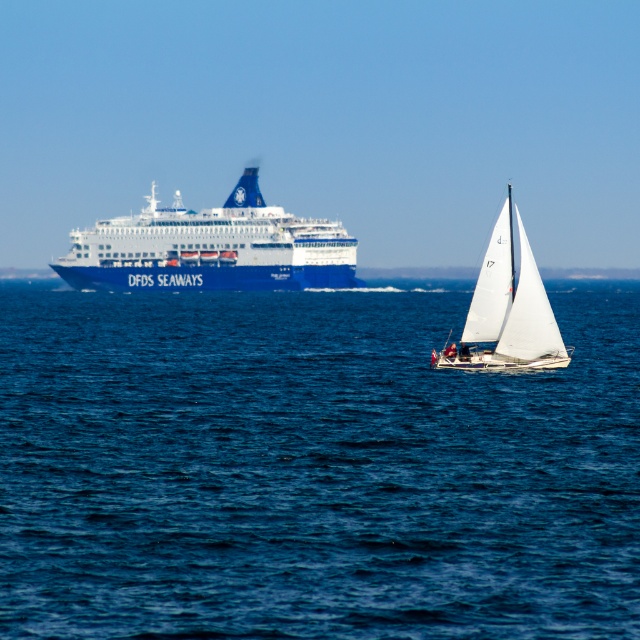
Describe the element at coordinates (312, 467) in the screenshot. I see `blue water at center` at that location.

Who is lower down, blue water at center or blue metallic cruise ship at upper left?

Positioned lower is blue water at center.

Between point (65, 632) and point (204, 273), which one is positioned behind?

The point (204, 273) is behind.

Identify the location of blue water at center. (312, 467).

Does blue water at center have a smaller size compared to white sailboat at center?

No, blue water at center is not smaller than white sailboat at center.

This screenshot has width=640, height=640. What are the coordinates of `blue water at center` in the screenshot? It's located at [x=312, y=467].

Which is more to the right, blue metallic cruise ship at upper left or blue matte water at upper center?

blue matte water at upper center

Is blue metallic cruise ship at upper left to the left of blue matte water at upper center from the viewer's perspective?

Yes, blue metallic cruise ship at upper left is to the left of blue matte water at upper center.

Is point (193, 264) positioned before point (557, 269)?

Yes, point (193, 264) is in front of point (557, 269).

Locate an element on the screen. blue metallic cruise ship at upper left is located at coordinates (211, 248).